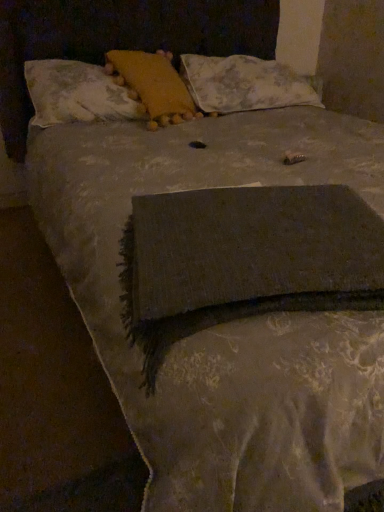
Question: From the image's perspective, is floral fabric pillow at upper center, which appears as the 3th pillow when viewed from the left, below yellow fabric pillow at upper center, the second pillow viewed from the left?

Choices:
 (A) yes
 (B) no

Answer: (B)

Question: Can you confirm if floral fabric pillow at upper center, placed as the 1th pillow when sorted from right to left, is thinner than yellow fabric pillow at upper center, the second pillow in the right-to-left sequence?

Choices:
 (A) yes
 (B) no

Answer: (B)

Question: Considering the relative sizes of floral fabric pillow at upper center, which appears as the 3th pillow when viewed from the left, and yellow fabric pillow at upper center, the second pillow viewed from the left, in the image provided, is floral fabric pillow at upper center, which appears as the 3th pillow when viewed from the left, shorter than yellow fabric pillow at upper center, the second pillow viewed from the left,?

Choices:
 (A) no
 (B) yes

Answer: (B)

Question: Does floral fabric pillow at upper center, placed as the 1th pillow when sorted from right to left, come in front of yellow fabric pillow at upper center, the second pillow in the right-to-left sequence?

Choices:
 (A) yes
 (B) no

Answer: (B)

Question: Does floral fabric pillow at upper center, which appears as the 3th pillow when viewed from the left, have a greater width compared to yellow fabric pillow at upper center, the second pillow viewed from the left?

Choices:
 (A) no
 (B) yes

Answer: (B)

Question: From a real-world perspective, is floral fabric pillow at upper center, placed as the 1th pillow when sorted from right to left, located beneath yellow fabric pillow at upper center, the second pillow in the right-to-left sequence?

Choices:
 (A) yes
 (B) no

Answer: (A)

Question: Is yellow fabric pillow at upper center, the second pillow viewed from the left, closer to camera compared to fluffy white pillow at upper center, acting as the 3th pillow starting from the right?

Choices:
 (A) no
 (B) yes

Answer: (A)

Question: Does yellow fabric pillow at upper center, the second pillow in the right-to-left sequence, have a lesser width compared to fluffy white pillow at upper center, acting as the 3th pillow starting from the right?

Choices:
 (A) yes
 (B) no

Answer: (B)

Question: Considering the relative sizes of yellow fabric pillow at upper center, the second pillow viewed from the left, and fluffy white pillow at upper center, acting as the 3th pillow starting from the right, in the image provided, is yellow fabric pillow at upper center, the second pillow viewed from the left, shorter than fluffy white pillow at upper center, acting as the 3th pillow starting from the right,?

Choices:
 (A) no
 (B) yes

Answer: (A)

Question: Is the position of yellow fabric pillow at upper center, the second pillow viewed from the left, more distant than that of fluffy white pillow at upper center, acting as the 3th pillow starting from the right?

Choices:
 (A) yes
 (B) no

Answer: (A)

Question: Does yellow fabric pillow at upper center, the second pillow in the right-to-left sequence, have a greater width compared to fluffy white pillow at upper center, acting as the 3th pillow starting from the right?

Choices:
 (A) yes
 (B) no

Answer: (A)

Question: Could you tell me if yellow fabric pillow at upper center, the second pillow viewed from the left, is facing fluffy white pillow at upper center, acting as the 3th pillow starting from the right?

Choices:
 (A) yes
 (B) no

Answer: (A)

Question: Can we say fluffy white pillow at upper center, acting as the 3th pillow starting from the right, lies outside floral fabric pillow at upper center, placed as the 1th pillow when sorted from right to left?

Choices:
 (A) yes
 (B) no

Answer: (A)